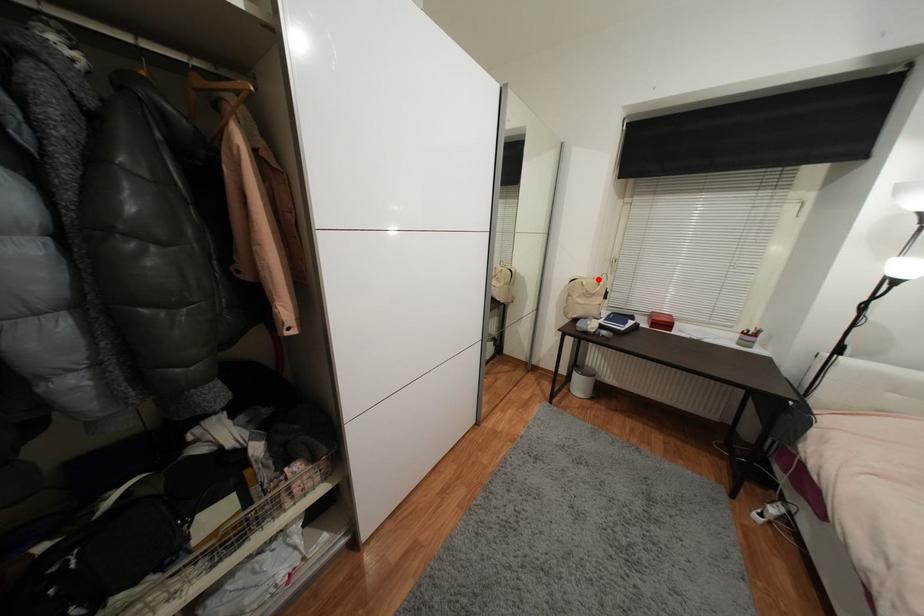
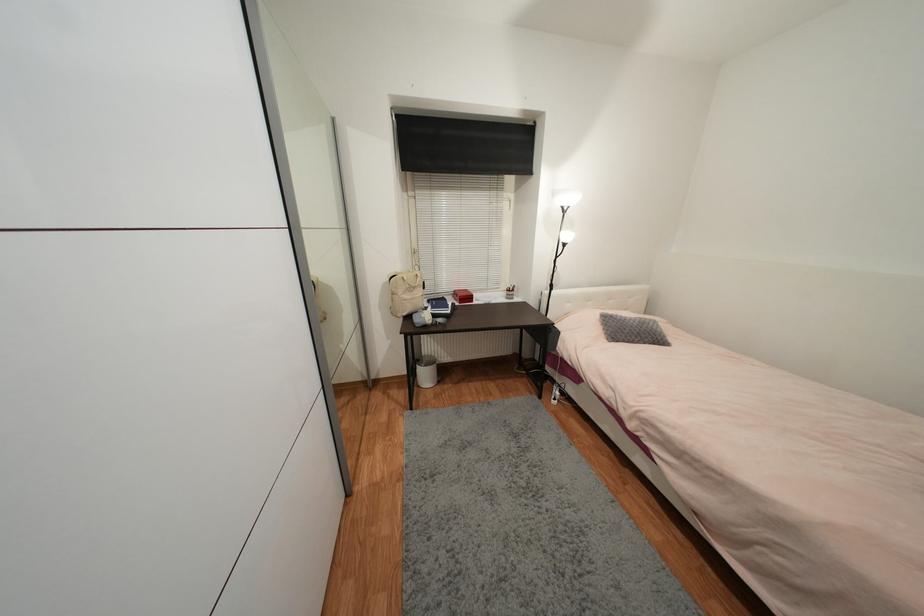
Question: I am providing you with two images of the same scene from different viewpoints. In image1, a red point is highlighted. Considering the same 3D point in image2, which of the following is correct?

Choices:
 (A) It is closer
 (B) It is farther

Answer: (B)